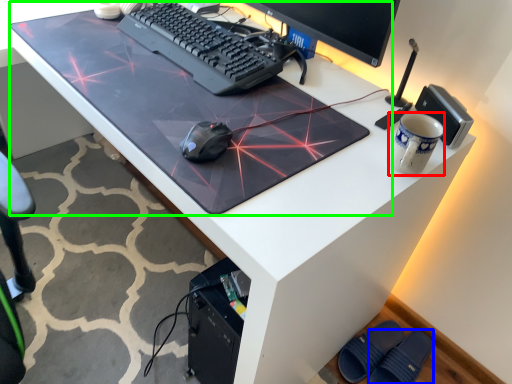
Question: Based on their relative distances, which object is farther from mug (highlighted by a red box)? Choose from slipper (highlighted by a blue box) and table top (highlighted by a green box).

Choices:
 (A) slipper
 (B) table top

Answer: (A)